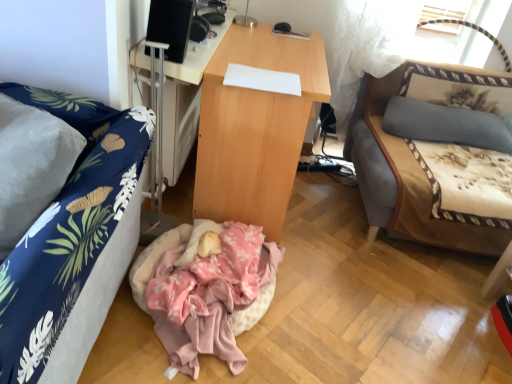
Question: Is blue fabric couch at left, which is the 2th studio couch from back to front, positioned in front of light brown wood desk at center, which is the 1th desk from right to left?

Choices:
 (A) yes
 (B) no

Answer: (A)

Question: From the image's perspective, is blue fabric couch at left, which is counted as the first studio couch, starting from the left, on top of light brown wood desk at center, which is the 1th desk from right to left?

Choices:
 (A) yes
 (B) no

Answer: (B)

Question: Is blue fabric couch at left, which is the 2th studio couch from back to front, further to camera compared to light brown wood desk at center, the second desk positioned from the left?

Choices:
 (A) yes
 (B) no

Answer: (B)

Question: Is light brown wood desk at center, which is the 1th desk from right to left, located within blue fabric couch at left, which is counted as the first studio couch, starting from the left?

Choices:
 (A) no
 (B) yes

Answer: (A)

Question: Does blue fabric couch at left, which is the 2th studio couch from back to front, turn towards light brown wood desk at center, the second desk positioned from the left?

Choices:
 (A) yes
 (B) no

Answer: (B)

Question: Is blue fabric couch at left, which is the 2th studio couch from back to front, not close to light brown wood desk at center, the second desk positioned from the left?

Choices:
 (A) yes
 (B) no

Answer: (B)

Question: Can we say wooden desk at center, arranged as the 1th desk when viewed from the left, lies outside blue fabric couch at left, the 2th studio couch positioned from the right?

Choices:
 (A) no
 (B) yes

Answer: (B)

Question: From the image's perspective, does wooden desk at center, the 2th desk in the right-to-left sequence, appear lower than blue fabric couch at left, the 2th studio couch positioned from the right?

Choices:
 (A) yes
 (B) no

Answer: (B)

Question: Considering the relative sizes of wooden desk at center, arranged as the 1th desk when viewed from the left, and blue fabric couch at left, which is counted as the first studio couch, starting from the left, in the image provided, is wooden desk at center, arranged as the 1th desk when viewed from the left, wider than blue fabric couch at left, which is counted as the first studio couch, starting from the left,?

Choices:
 (A) no
 (B) yes

Answer: (A)

Question: Does wooden desk at center, arranged as the 1th desk when viewed from the left, come behind blue fabric couch at left, the 2th studio couch positioned from the right?

Choices:
 (A) no
 (B) yes

Answer: (B)

Question: Could you tell me if wooden desk at center, the 2th desk in the right-to-left sequence, is turned towards blue fabric couch at left, acting as the 1th studio couch starting from the front?

Choices:
 (A) no
 (B) yes

Answer: (A)

Question: Is wooden desk at center, the 2th desk in the right-to-left sequence, shorter than blue fabric couch at left, the 2th studio couch positioned from the right?

Choices:
 (A) yes
 (B) no

Answer: (A)

Question: Considering the relative sizes of wooden desk at center, arranged as the 1th desk when viewed from the left, and beige fabric studio couch at right, the first studio couch from the right, in the image provided, is wooden desk at center, arranged as the 1th desk when viewed from the left, bigger than beige fabric studio couch at right, the first studio couch from the right,?

Choices:
 (A) no
 (B) yes

Answer: (A)